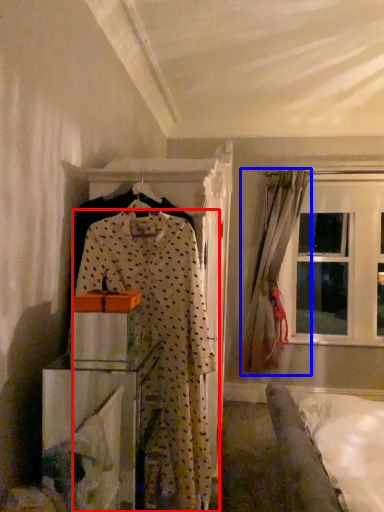
Question: Which of the following is the closest to the observer, fancy dress (highlighted by a red box) or curtain (highlighted by a blue box)?

Choices:
 (A) fancy dress
 (B) curtain

Answer: (A)